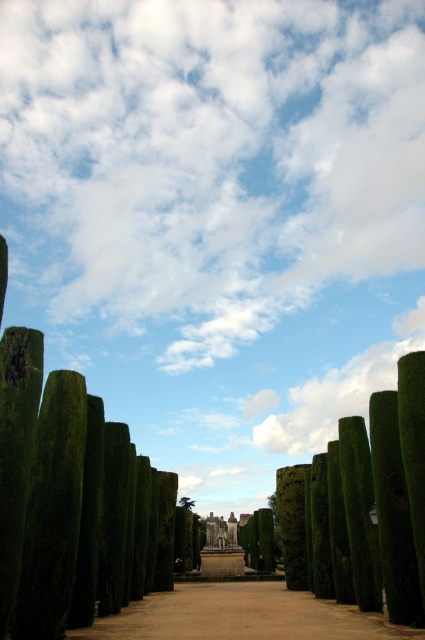
Question: Does brown dirt path at center have a greater width compared to green leafy tree at center?

Choices:
 (A) yes
 (B) no

Answer: (A)

Question: Which point appears closest to the camera in this image?

Choices:
 (A) (193, 502)
 (B) (135, 618)

Answer: (B)

Question: Is brown dirt path at center to the left of green leafy tree at center from the viewer's perspective?

Choices:
 (A) no
 (B) yes

Answer: (A)

Question: In this image, where is brown dirt path at center located relative to green leafy tree at center?

Choices:
 (A) below
 (B) above

Answer: (B)

Question: Which point is closer to the camera taking this photo?

Choices:
 (A) (189, 506)
 (B) (317, 620)

Answer: (B)